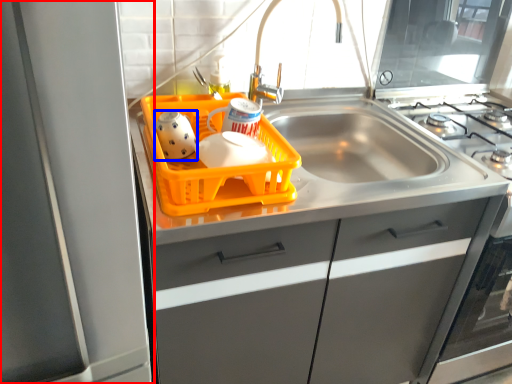
Question: Among these objects, which one is nearest to the camera, appliance (highlighted by a red box) or tea pot (highlighted by a blue box)?

Choices:
 (A) appliance
 (B) tea pot

Answer: (A)